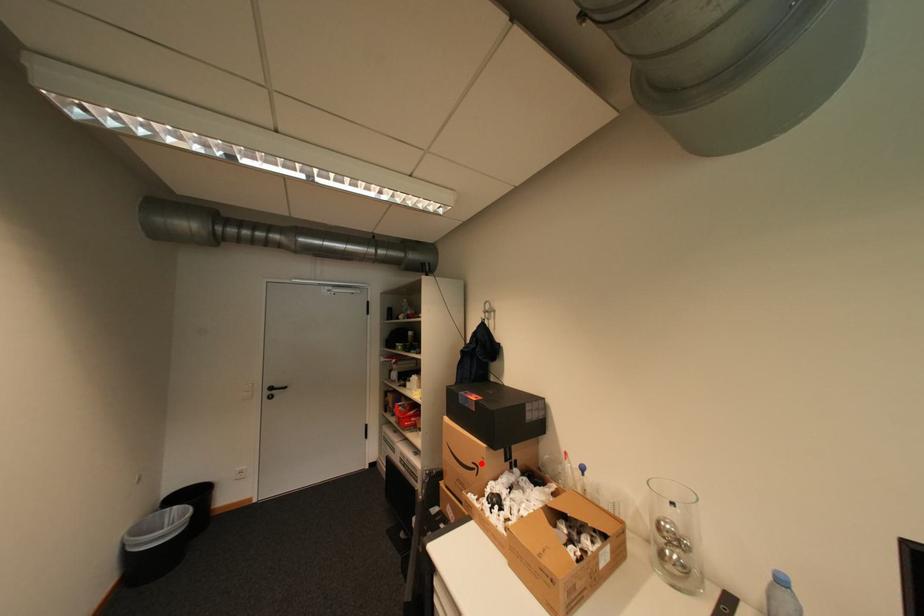
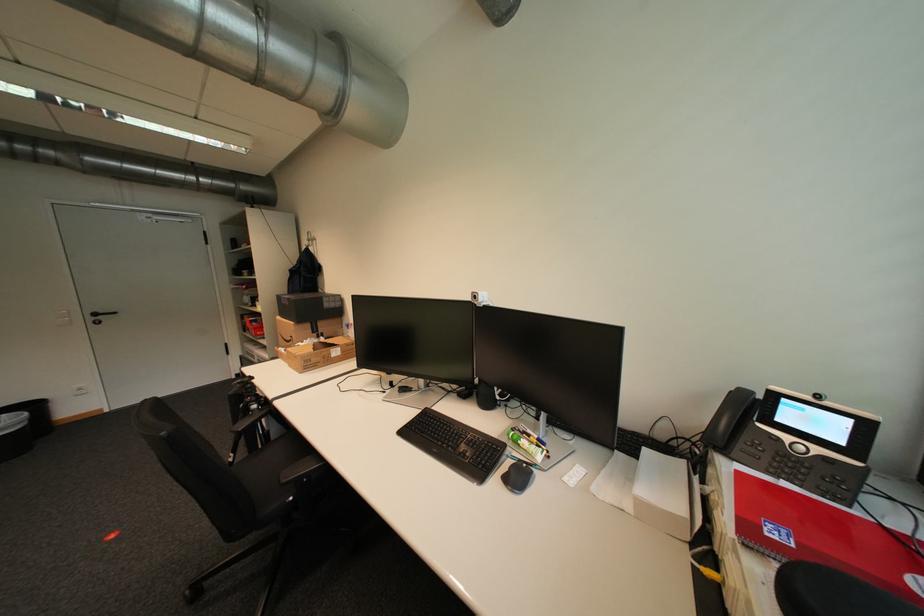
The point at the highlighted location is marked in the first image. Where is the corresponding point in the second image?

(299, 338)